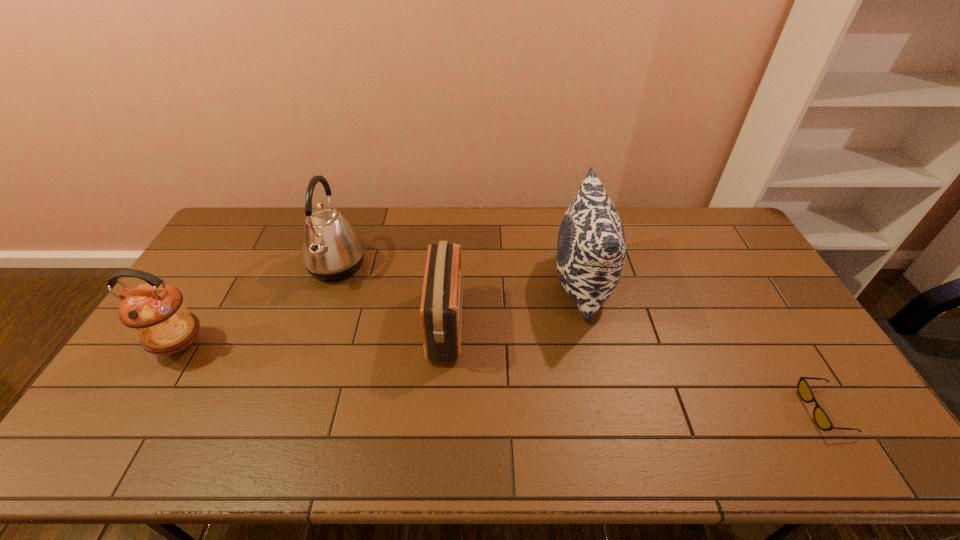
The image size is (960, 540). Identify the location of free space between the kettle and the rightmost object. (580, 338).

Locate an element on the screen. This screenshot has width=960, height=540. unoccupied area between the second object from right to left and the leftmost object is located at coordinates (381, 314).

Where is `vacant region between the fourth object from left to right and the rightmost object`? vacant region between the fourth object from left to right and the rightmost object is located at coordinates (703, 347).

This screenshot has width=960, height=540. I want to click on free area in between the leftmost object and the second object from left to right, so click(x=258, y=305).

Locate an element on the screen. The image size is (960, 540). free spot between the cushion and the nearest object is located at coordinates (703, 347).

The height and width of the screenshot is (540, 960). Identify the location of vacant region between the leftmost object and the cushion. (381, 314).

Where is `object that can be found as the fourth closest to the cushion`? The height and width of the screenshot is (540, 960). object that can be found as the fourth closest to the cushion is located at coordinates (155, 310).

Locate an element on the screen. This screenshot has height=540, width=960. object that stands as the second closest to the rightmost object is located at coordinates (441, 303).